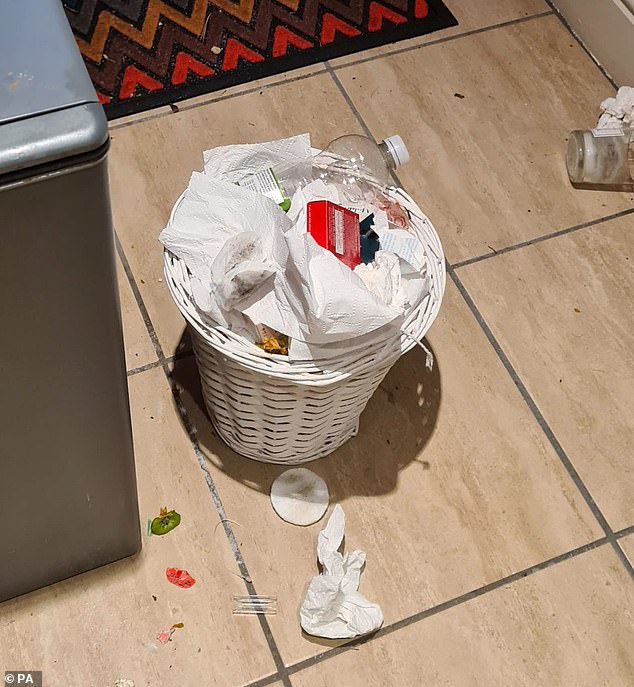
Locate an element on the screen. floormats is located at coordinates (262, 45).